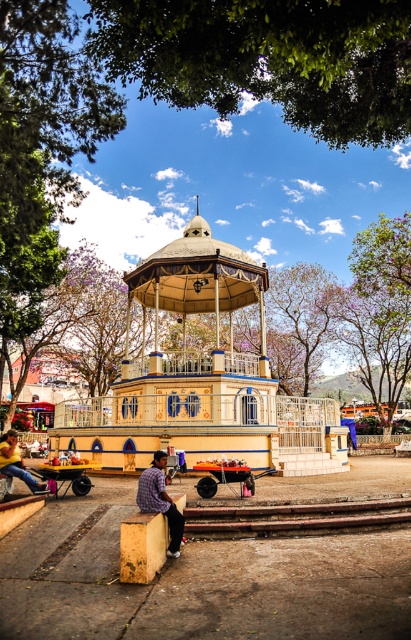
Who is positioned more to the right, beige painted wood gazebo at center or rusty metal train track at lower center?

Positioned to the right is rusty metal train track at lower center.

The height and width of the screenshot is (640, 411). Describe the element at coordinates (200, 378) in the screenshot. I see `beige painted wood gazebo at center` at that location.

Find the location of a particular element. The width and height of the screenshot is (411, 640). beige painted wood gazebo at center is located at coordinates (200, 378).

Can you confirm if plaid shirt at lower center is bigger than denim pants at lower left?

Actually, plaid shirt at lower center might be smaller than denim pants at lower left.

Is plaid shirt at lower center shorter than denim pants at lower left?

Yes, plaid shirt at lower center is shorter than denim pants at lower left.

Between point (161, 460) and point (25, 476), which one is positioned in front?

Point (161, 460) is more forward.

The width and height of the screenshot is (411, 640). What are the coordinates of `plaid shirt at lower center` in the screenshot? It's located at (161, 499).

Does rusty metal train track at lower center have a lesser width compared to plaid shirt at lower center?

No, rusty metal train track at lower center is not thinner than plaid shirt at lower center.

Is rusty metal train track at lower center below plaid shirt at lower center?

Yes.

Does point (355, 524) lie behind point (170, 554)?

Yes, point (355, 524) is behind point (170, 554).

The image size is (411, 640). In order to click on rusty metal train track at lower center in this screenshot , I will do `click(295, 516)`.